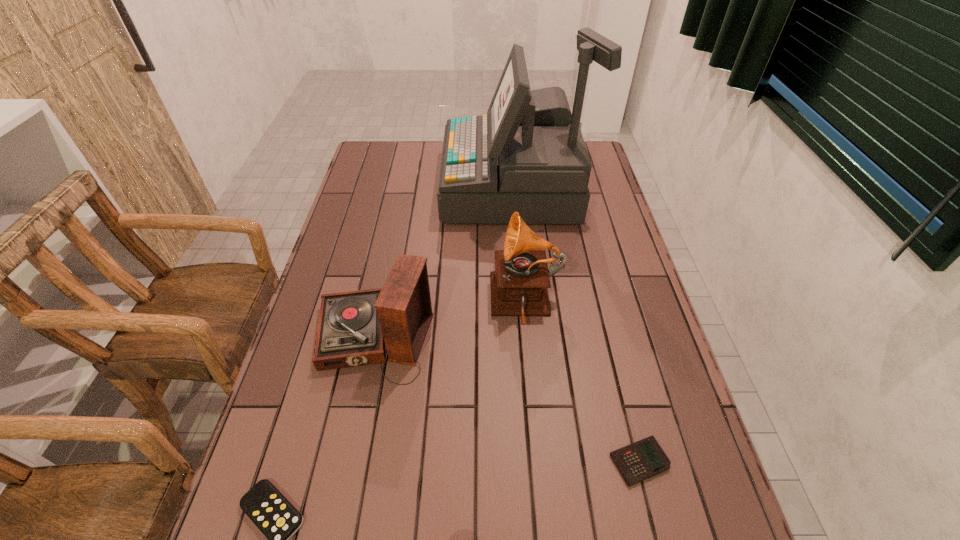
The width and height of the screenshot is (960, 540). Find the location of `vacant space that satisfies the following two spatial constraints: 1. on the horn of the calculator; 2. on the left side of the taller phonograph record`. vacant space that satisfies the following two spatial constraints: 1. on the horn of the calculator; 2. on the left side of the taller phonograph record is located at coordinates (540, 462).

The width and height of the screenshot is (960, 540). I want to click on vacant area that satisfies the following two spatial constraints: 1. on the customer-facing side of the farthest object; 2. on the right side of the calculator, so click(538, 462).

Identify the location of free spot that satisfies the following two spatial constraints: 1. on the customer-facing side of the tallest object; 2. on the right side of the calculator. (538, 462).

The width and height of the screenshot is (960, 540). Identify the location of free space that satisfies the following two spatial constraints: 1. on the back side of the calculator; 2. on the customer-facing side of the cash register. (571, 187).